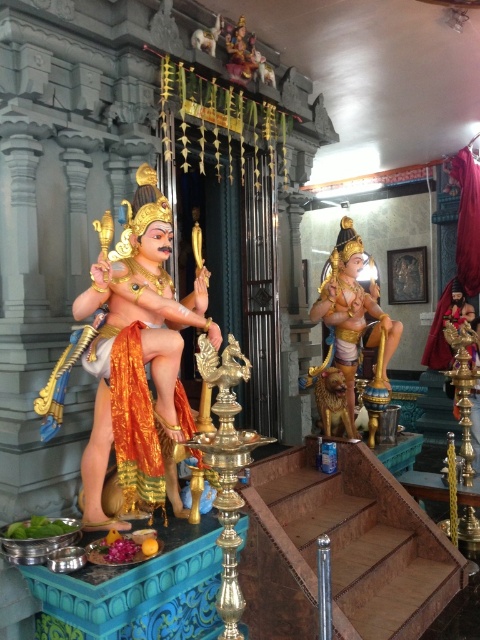
Which of these two, goldmaterial/texture statue at center or gold metallic statue at center, stands shorter?

goldmaterial/texture statue at center

Between point (74, 301) and point (365, 298), which one is positioned behind?

The point (365, 298) is behind.

At what (x,y) coordinates should I click in order to perform the action: click on goldmaterial/texture statue at center. Please return your answer as a coordinate pair (x, y). The image size is (480, 640). Looking at the image, I should click on (137, 355).